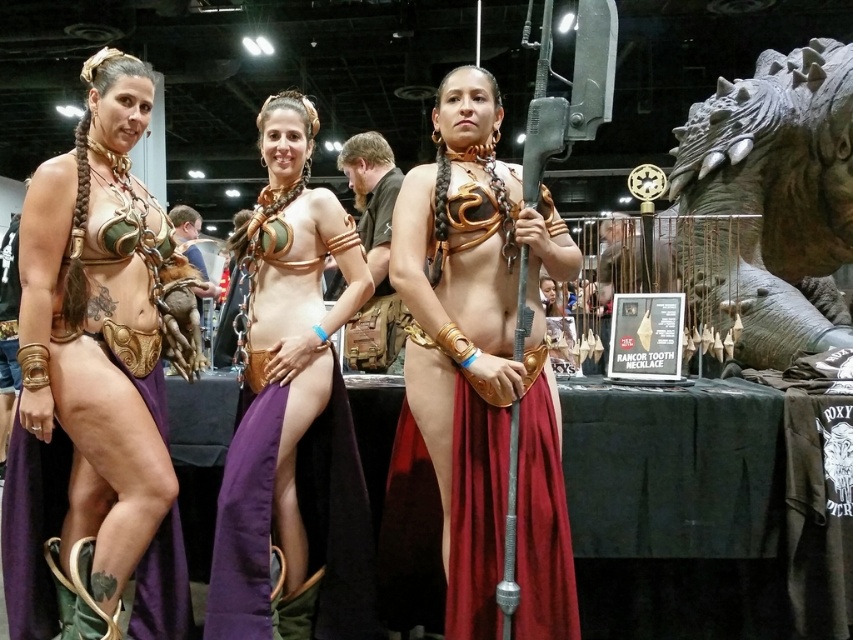
You are a photographer at the event and need to position the gold metallic armor at left and the metallic gold armor at center for a photo. Which armor should be placed in the back to ensure both are visible in the frame?

The gold metallic armor at left is taller than the metallic gold armor at center, so placing the gold metallic armor at left in the back will ensure both are visible in the frame.

You are a photographer at the event and want to capture a photo of both the metallic gold armor at center and the matte gold bikini top at center. Which object should you position to the left in your camera frame to ensure both are in the shot?

To ensure both the metallic gold armor at center and the matte gold bikini top at center are in the shot, position the matte gold bikini top at center to the left since the metallic gold armor at center is to the right of it.